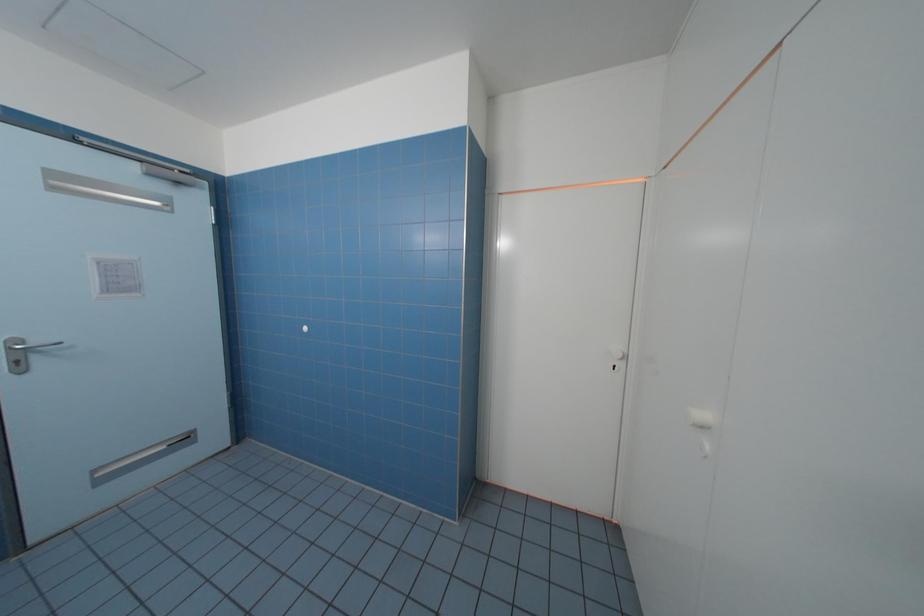
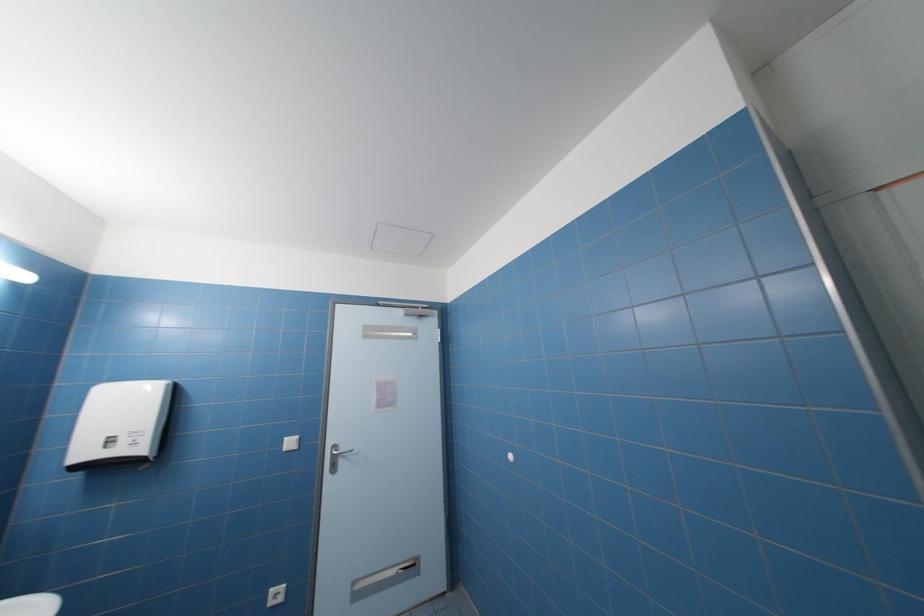
The images are taken continuously from a first-person perspective. In which direction is your viewpoint rotating?

The rotation direction of the camera is left-up.